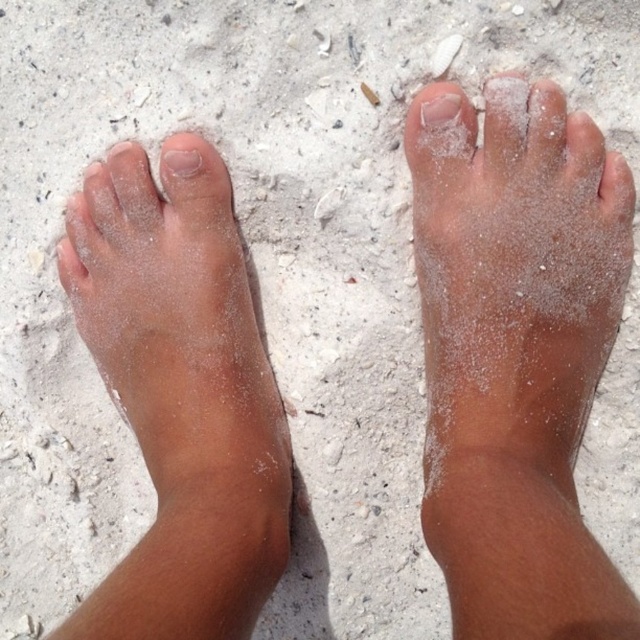
You are a dermatologist analyzing the image of two feet on sand. You notice the sandy skin foot at center and the smooth skin toe at center. Which one has a greater height?

The sandy skin foot at center is much taller than the smooth skin toe at center.